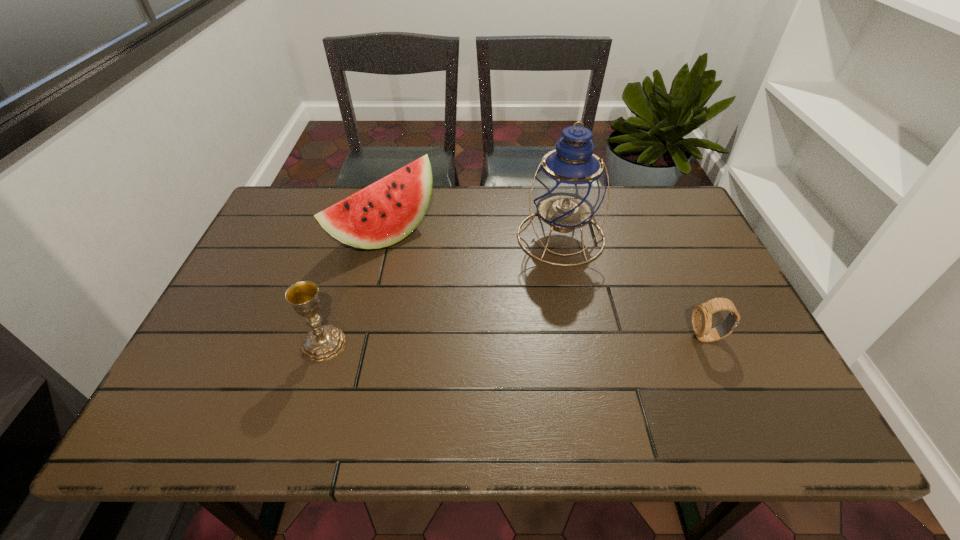
Find the location of a particular element. Image resolution: width=960 pixels, height=540 pixels. free space on the desktop that is between the chalice and the shortest object and is positioned on the outer rind of the watermelon is located at coordinates (548, 340).

This screenshot has width=960, height=540. I want to click on vacant space on the desktop that is between the chalice and the watch and is positioned on the front-facing side of the lantern, so (573, 339).